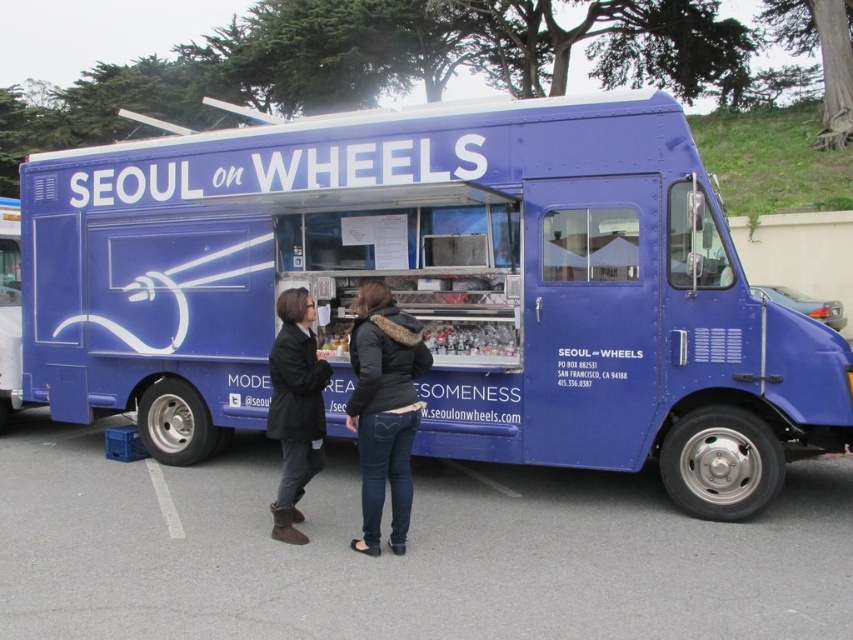
Question: Which object is closer to the camera taking this photo?

Choices:
 (A) dark blue leather jacket at center
 (B) dark brown leather boots at lower center
 (C) gray asphalt at lower center
 (D) blue matte food truck at center

Answer: (C)

Question: Based on their relative distances, which object is nearer to the dark brown leather boots at lower center?

Choices:
 (A) dark blue leather jacket at center
 (B) gray asphalt at lower center

Answer: (A)

Question: Is gray asphalt at lower center to the right of dark blue leather jacket at center from the viewer's perspective?

Choices:
 (A) yes
 (B) no

Answer: (A)

Question: Is gray asphalt at lower center closer to camera compared to dark brown leather boots at lower center?

Choices:
 (A) yes
 (B) no

Answer: (A)

Question: Which of the following is the closest to the observer?

Choices:
 (A) (665, 216)
 (B) (285, 317)
 (C) (286, 388)
 (D) (579, 520)

Answer: (C)

Question: Where is blue matte food truck at center located in relation to gray asphalt at lower center in the image?

Choices:
 (A) left
 (B) right

Answer: (A)